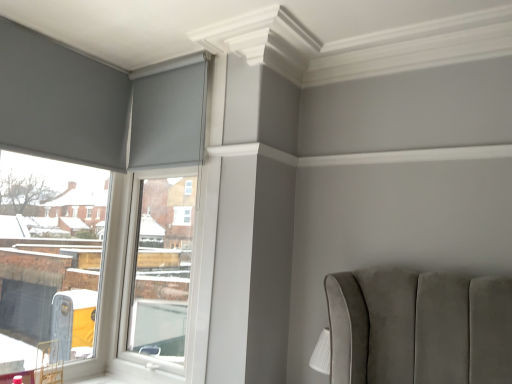
Locate an element on the screen. vacant space situated above matte gray curtain at upper left (from a real-world perspective) is located at coordinates (181, 53).